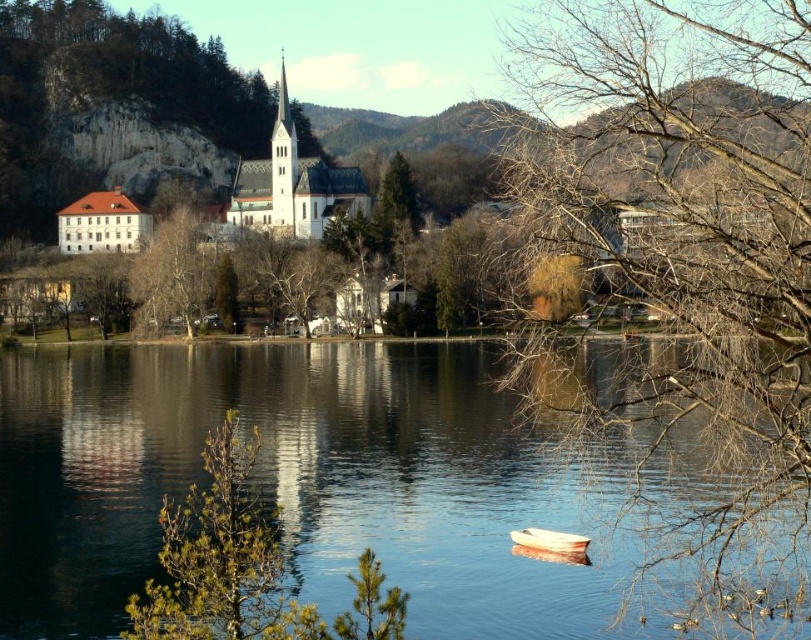
You are an artist sketching the lakeside scene. You notice two trees in the center of the image, a bare branches at center and a green textured tree at center. Which tree should you draw first if you want to focus on the larger one?

The bare branches at center is bigger than the green textured tree at center, so you should draw the bare branches at center first.

You are an artist trying to sketch this lakeside scene. You want to ensure the proportions between the bare branches at center and the white plastic boat at lower center are accurate. Based on the scene, which object should you draw wider in your sketch?

The bare branches at center should be drawn wider than the white plastic boat at lower center because the description states that the bare branches at center might be wider than the white plastic boat at lower center.